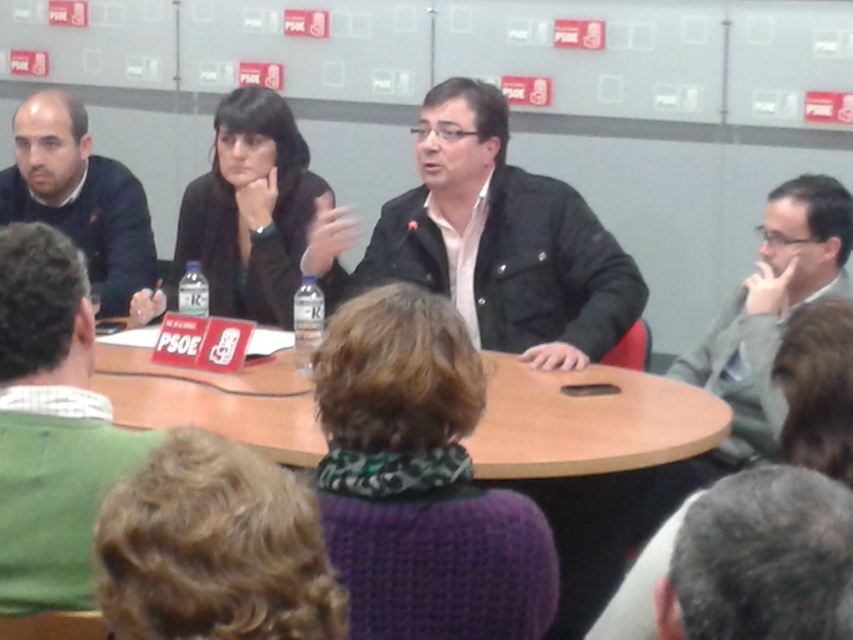
Can you confirm if wooden table at center is shorter than gray fabric suit at right?

Indeed, wooden table at center has a lesser height compared to gray fabric suit at right.

Which is above, wooden table at center or gray fabric suit at right?

gray fabric suit at right is higher up.

At what (x,y) coordinates should I click in order to perform the action: click on wooden table at center. Please return your answer as a coordinate pair (x, y). The height and width of the screenshot is (640, 853). Looking at the image, I should click on (589, 420).

Does matte black jacket at center have a lesser height compared to green sweater at lower left?

Incorrect, matte black jacket at center's height does not fall short of green sweater at lower left's.

You are a GUI agent. You are given a task and a screenshot of the screen. Output one action in this format:
    pyautogui.click(x=<x>, y=<y>)
    Task: Click on the matte black jacket at center
    This screenshot has width=853, height=640.
    Given the screenshot: What is the action you would take?
    pyautogui.click(x=490, y=241)

Where is `matte black jacket at center`? The height and width of the screenshot is (640, 853). matte black jacket at center is located at coordinates (490, 241).

Between matte black jacket at center and gray fabric suit at right, which one is positioned higher?

Positioned higher is matte black jacket at center.

Does point (593, 300) come behind point (755, 284)?

Yes.

Identify the location of matte black jacket at center. The width and height of the screenshot is (853, 640). (490, 241).

Locate an element on the screen. matte black jacket at center is located at coordinates (490, 241).